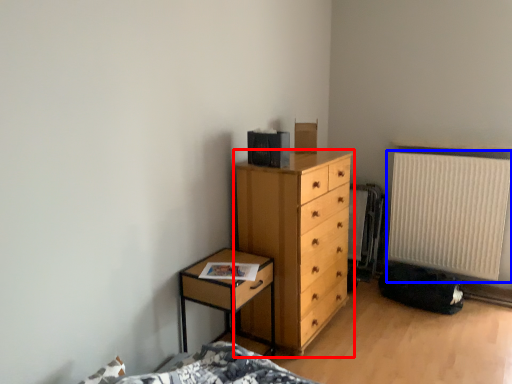
Question: Which object appears closest to the camera in this image, chest of drawers (highlighted by a red box) or radiator (highlighted by a blue box)?

Choices:
 (A) chest of drawers
 (B) radiator

Answer: (A)